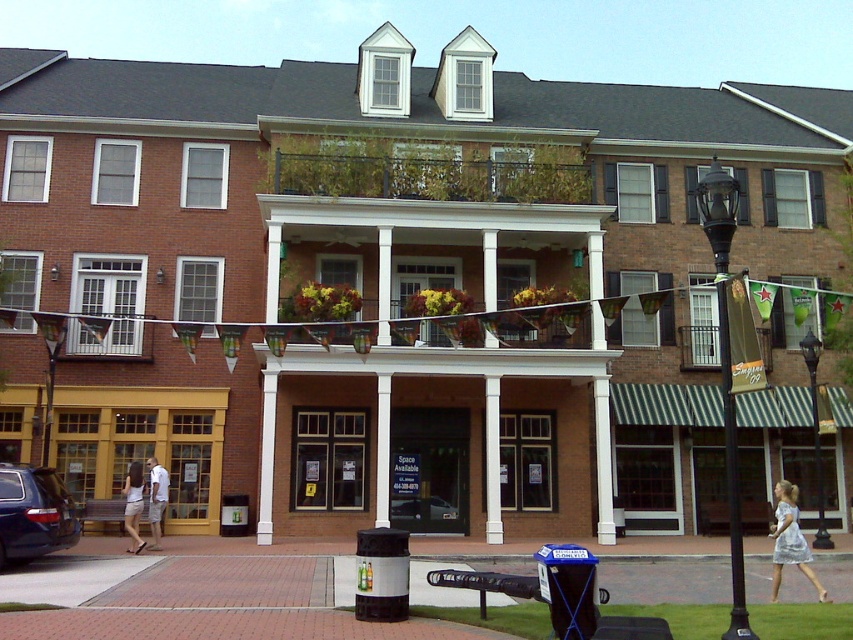
You are a customer looking for the entrance to the building. You see a silver glitter dress at lower right and a black metal lamp post at center. Which object is closer to the entrance?

The silver glitter dress at lower right is to the left of the black metal lamp post at center. Since the entrance is near the center where the lamp post is located, the black metal lamp post at center is closer to the entrance.

You are standing in front of the two story brick building and want to install a new light fixture. The existing black polished metal streetlamp at center right is in the way. Where should you place the new fixture to avoid it?

The black polished metal streetlamp at center right is located at point (726, 369), so place the new fixture elsewhere to avoid overlapping with it.